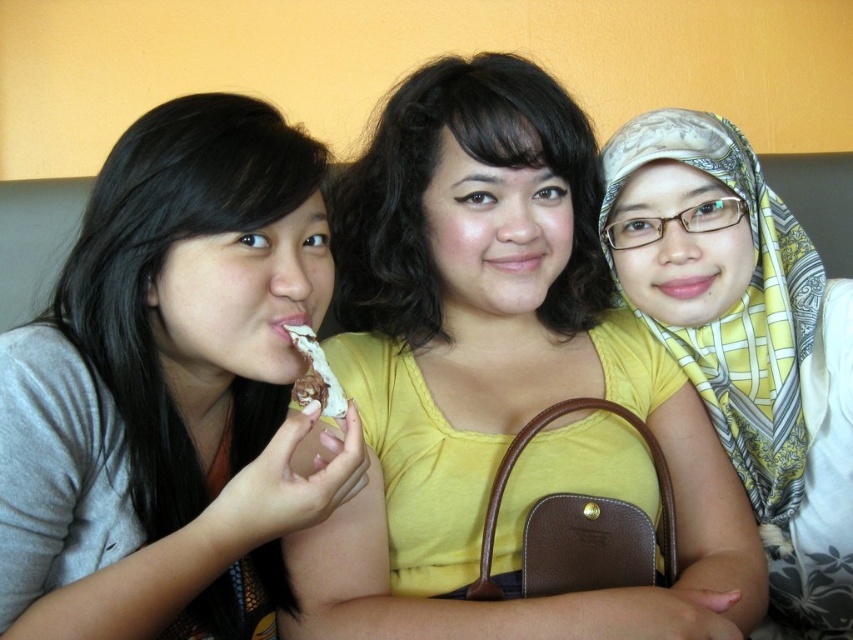
Question: Which object appears farthest from the camera in this image?

Choices:
 (A) chocolate frosted cake at center
 (B) matte yellow shirt at center
 (C) matte gray shirt at left

Answer: (B)

Question: Considering the relative positions of yellow matte shirt at center and matte gray shirt at left in the image provided, where is yellow matte shirt at center located with respect to matte gray shirt at left?

Choices:
 (A) above
 (B) below

Answer: (A)

Question: Considering the relative positions of yellow matte shirt at center and matte yellow shirt at center in the image provided, where is yellow matte shirt at center located with respect to matte yellow shirt at center?

Choices:
 (A) right
 (B) left

Answer: (A)

Question: Which is nearer to the yellow matte shirt at center?

Choices:
 (A) matte yellow shirt at center
 (B) matte gray shirt at left

Answer: (A)

Question: Which object is positioned closest to the matte gray shirt at left?

Choices:
 (A) matte yellow shirt at center
 (B) yellow matte shirt at center

Answer: (B)

Question: Can you confirm if yellow matte shirt at center is bigger than matte gray shirt at left?

Choices:
 (A) no
 (B) yes

Answer: (B)